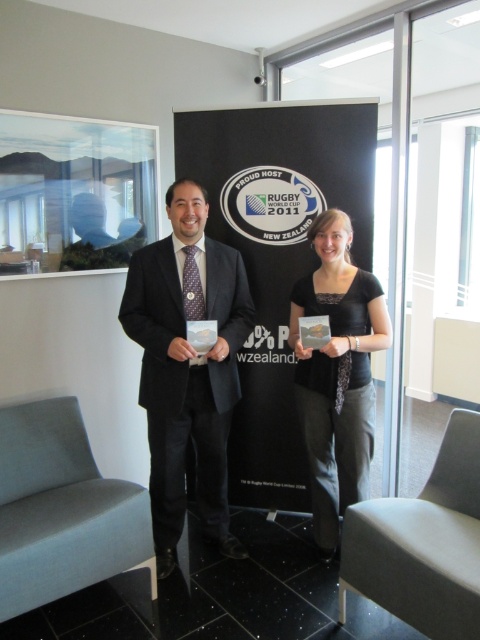
I want to click on black suit at center, so click(x=187, y=365).

Can you confirm if black suit at center is shorter than black textured shirt at center?

Incorrect, black suit at center's height does not fall short of black textured shirt at center's.

Does point (238, 275) come farther from viewer compared to point (325, 435)?

Yes, point (238, 275) is farther from viewer.

Locate an element on the screen. This screenshot has height=640, width=480. black suit at center is located at coordinates (x=187, y=365).